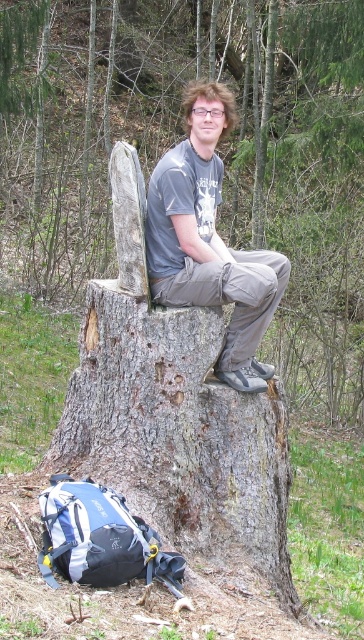
Question: Is smooth gray tree stump at center bigger than gray rough bark tree trunk at center?

Choices:
 (A) yes
 (B) no

Answer: (A)

Question: Which point is farther from the camera taking this photo?

Choices:
 (A) (64, 182)
 (B) (212, 458)

Answer: (A)

Question: Among these points, which one is nearest to the camera?

Choices:
 (A) (195, 115)
 (B) (195, 374)
 (C) (85, 228)

Answer: (B)

Question: Which point is farther to the camera?

Choices:
 (A) (212, 467)
 (B) (104, 92)

Answer: (B)

Question: From the image, what is the correct spatial relationship of gray rough bark tree trunk at center in relation to matte gray shirt at center?

Choices:
 (A) above
 (B) below

Answer: (B)

Question: Is smooth gray tree stump at center positioned behind gray rough bark tree trunk at center?

Choices:
 (A) no
 (B) yes

Answer: (B)